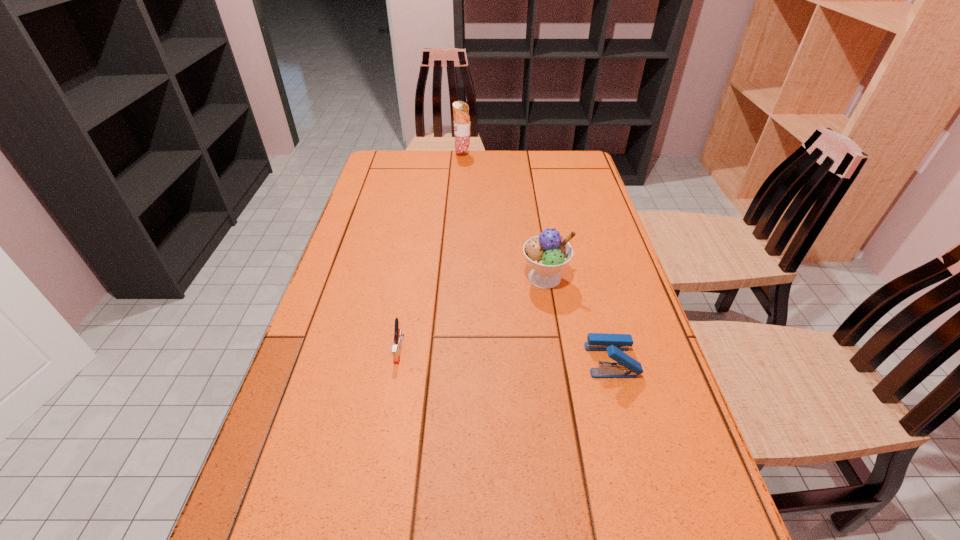
The height and width of the screenshot is (540, 960). In order to click on vacant region between the second object from right to left and the rightmost object in this screenshot , I will do (578, 319).

I want to click on vacant space that is in between the leftmost object and the farthest object, so click(431, 252).

Locate an element on the screen. The width and height of the screenshot is (960, 540). object that ranks as the second closest to the farthest object is located at coordinates (398, 334).

Locate an element on the screen. This screenshot has height=540, width=960. object that is the second closest to the rightmost object is located at coordinates (398, 334).

The image size is (960, 540). I want to click on the second closest stapler to the second farthest object, so click(x=398, y=334).